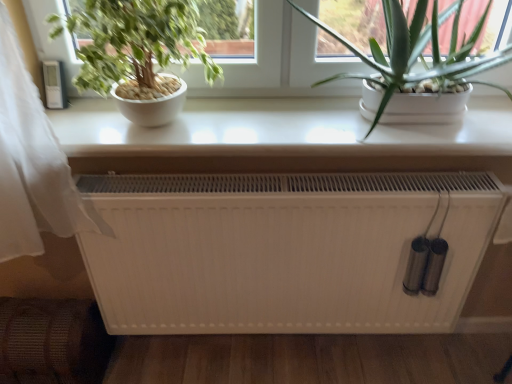
You are a GUI agent. You are given a task and a screenshot of the screen. Output one action in this format:
    pyautogui.click(x=<x>, y=<y>)
    Task: Click on the vacant space underneath green matte plant at left, which appears as the first houseplant when viewed from the left (from a real-world perspective)
    
    Given the screenshot: What is the action you would take?
    pos(152,129)